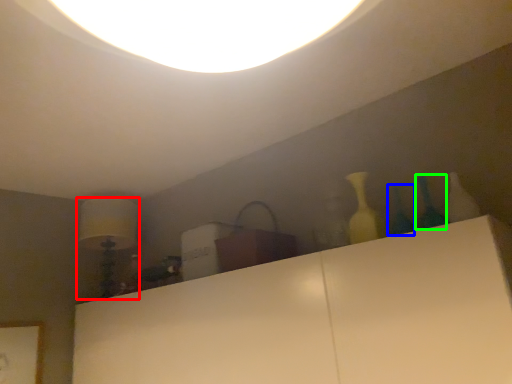
Question: Based on their relative distances, which object is farther from lamp (highlighted by a red box)? Choose from glass vase (highlighted by a blue box) and glass vase (highlighted by a green box).

Choices:
 (A) glass vase
 (B) glass vase

Answer: (B)